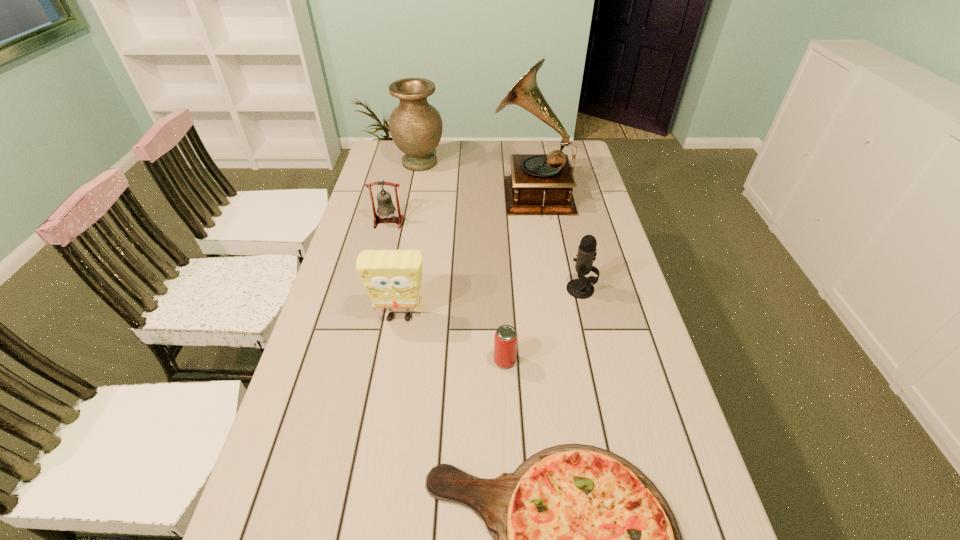
At what (x,y) coordinates should I click in order to perform the action: click on vacant region between the fifth farthest object and the microphone. Please return your answer as a coordinate pair (x, y). Looking at the image, I should click on (490, 303).

Identify the location of free area in between the microphone and the vase. (500, 226).

Identify which object is the second nearest to the second nearest object. Please provide its 2D coordinates. Your answer should be formatted as a tuple, i.e. [(x, y)], where the tuple contains the x and y coordinates of a point satisfying the conditions above.

[(583, 539)]

Identify which object is the nearest to the record player. Please provide its 2D coordinates. Your answer should be formatted as a tuple, i.e. [(x, y)], where the tuple contains the x and y coordinates of a point satisfying the conditions above.

[(416, 126)]

Locate an element on the screen. The height and width of the screenshot is (540, 960). free space that satisfies the following two spatial constraints: 1. on the horn of the record player; 2. on the face of the sponge is located at coordinates (551, 316).

Identify the location of vacant space that satisfies the following two spatial constraints: 1. on the horn of the record player; 2. on the front side of the bell. The image size is (960, 540). (537, 222).

Find the location of a particular element. vacant position in the image that satisfies the following two spatial constraints: 1. on the horn of the record player; 2. on the face of the third nearest object is located at coordinates (551, 316).